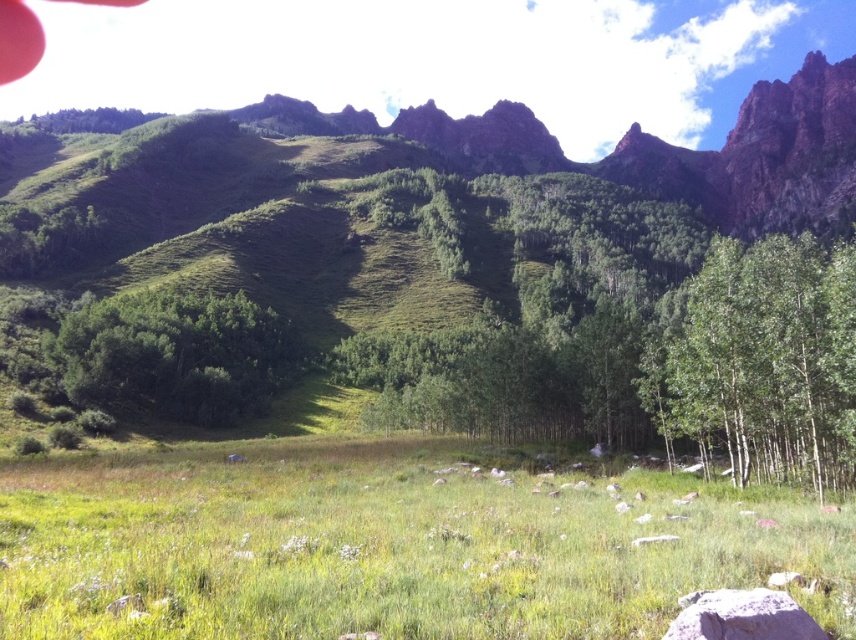
You are standing in the mountain landscape and want to take a photo of the green grassy field at center and the green matte tree at lower right. From your current position, which object is closer to the camera?

The green grassy field at center is closer to the camera because it is positioned below the green matte tree at lower right, indicating it is in the foreground.

You are standing at the base of the mountain in the meadow. You see two points marked in the image. One is at point coordinates point (x=694, y=385) and the other is at point (x=762, y=620). Which point is closer to you?

Point (x=762, y=620) is closer to you because it is in front of point (x=694, y=385).

You are standing in the meadow and want to place a small flag at the base of the green leafy tree at center. Can you place it directly in front of the gray rock at lower center without moving the rock?

The green leafy tree at center is above the gray rock at lower center, so placing the flag directly in front of the gray rock at lower center would mean placing it under the tree, which is possible as long as there is space between them. However, since the tree is above the rock, the flag can be placed in front of the rock without moving it.